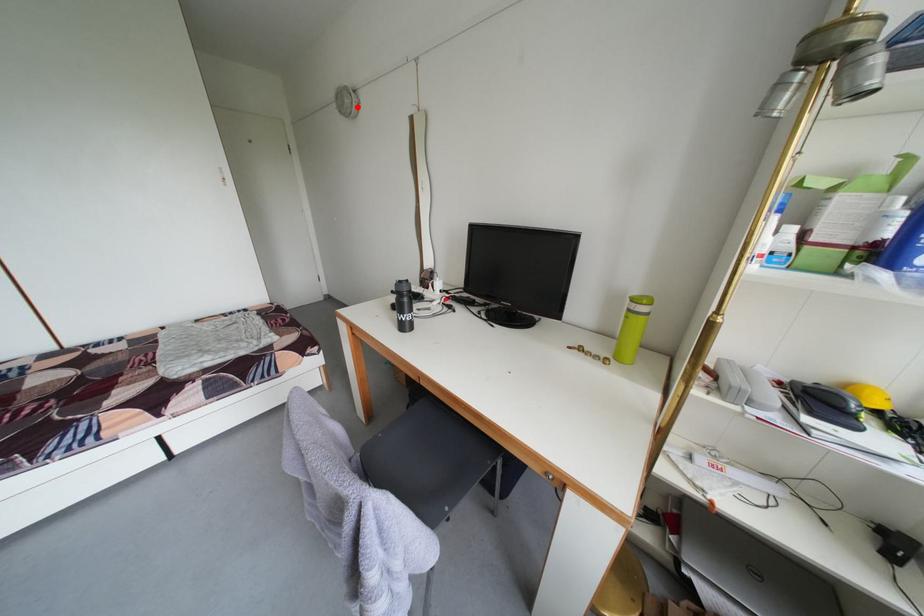
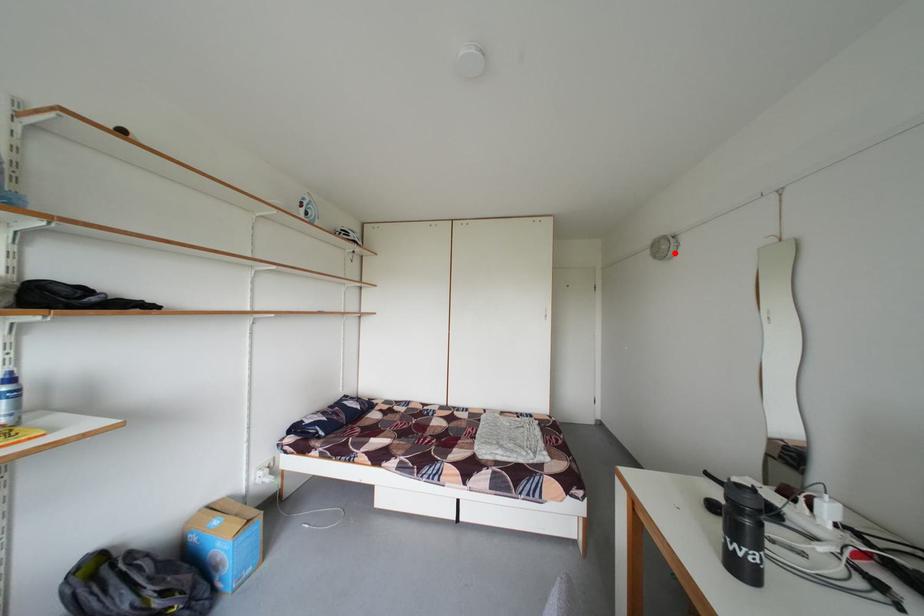
I am providing you with two images of the same scene from different viewpoints. A red point is marked on the first image and another point is marked on the second image. Is the red point in image1 aligned with the point shown in image2?

Yes